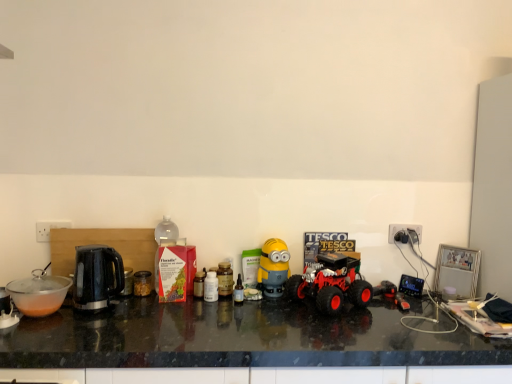
Question: Is black granite countertop at center to the left or to the right of rubberized red toy truck at center in the image?

Choices:
 (A) right
 (B) left

Answer: (B)

Question: Is black granite countertop at center taller or shorter than rubberized red toy truck at center?

Choices:
 (A) tall
 (B) short

Answer: (A)

Question: Which object is the closest to the red matte truck at center, which ranks as the first toy in right-to-left order?

Choices:
 (A) black plastic kettle at left
 (B) rubberized red toy truck at center
 (C) translucent plastic bottle at center, positioned as the first bottle in right-to-left order
 (D) transparent plastic bowl at left
 (E) white plastic bottle at center, which is the third bottle in right-to-left order

Answer: (B)

Question: Based on their relative distances, which object is nearer to the red matte truck at center, the second toy positioned from the left?

Choices:
 (A) translucent plastic bottle at center, which is the second bottle in right-to-left order
 (B) black plastic power outlet at right
 (C) rubberized red toy truck at center
 (D) translucent plastic bottle at center, positioned as the first bottle in right-to-left order
 (E) black granite countertop at center

Answer: (B)